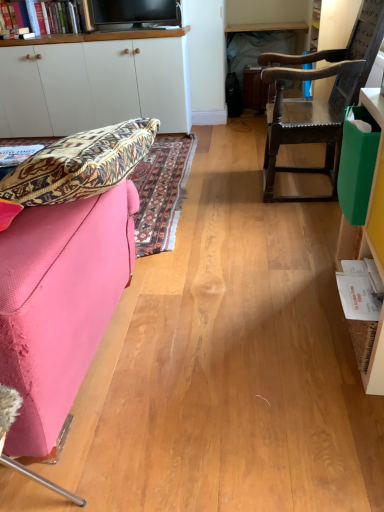
This screenshot has height=512, width=384. I want to click on free space that is in between green plastic bag at right, which ranks as the first cabinetry in bottom-to-top order, and pink fabric couch at left, so click(237, 340).